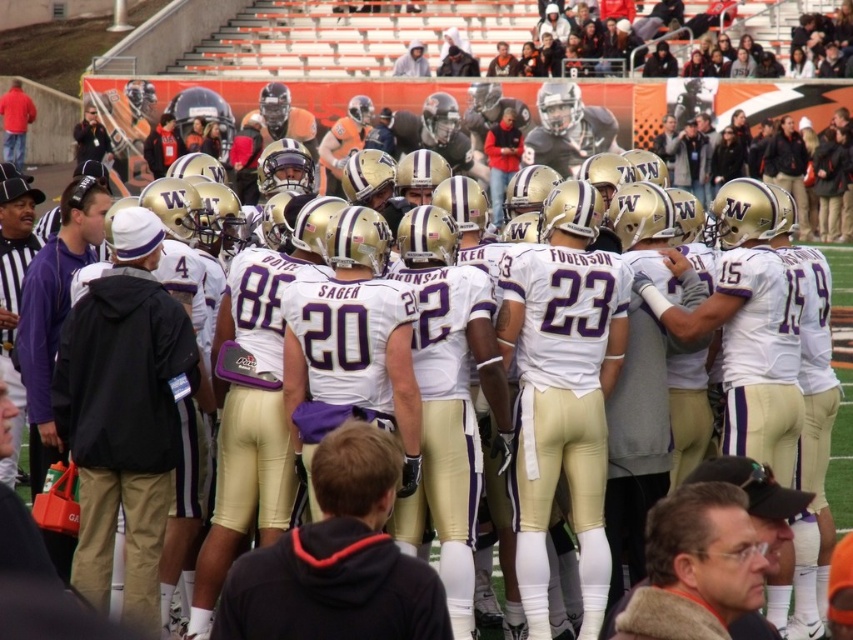
Does black fabric jacket at center have a greater height compared to black hoodie at center?

No, black fabric jacket at center is not taller than black hoodie at center.

Which is more to the left, black fabric jacket at center or black hoodie at center?

black fabric jacket at center is more to the left.

Does point (158, 400) come in front of point (306, 637)?

No, it is not.

At what (x,y) coordinates should I click in order to perform the action: click on black fabric jacket at center. Please return your answer as a coordinate pair (x, y). Looking at the image, I should click on (125, 412).